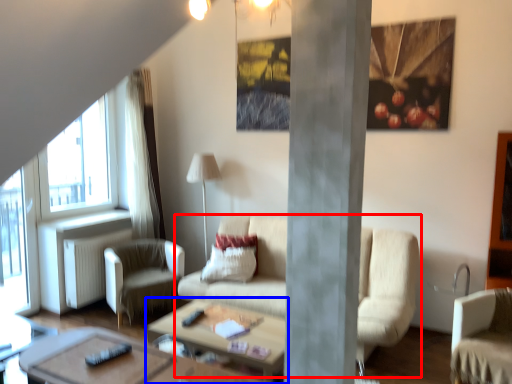
Question: Which point is closer to the camera, studio couch (highlighted by a red box) or coffee table (highlighted by a blue box)?

Choices:
 (A) studio couch
 (B) coffee table

Answer: (B)